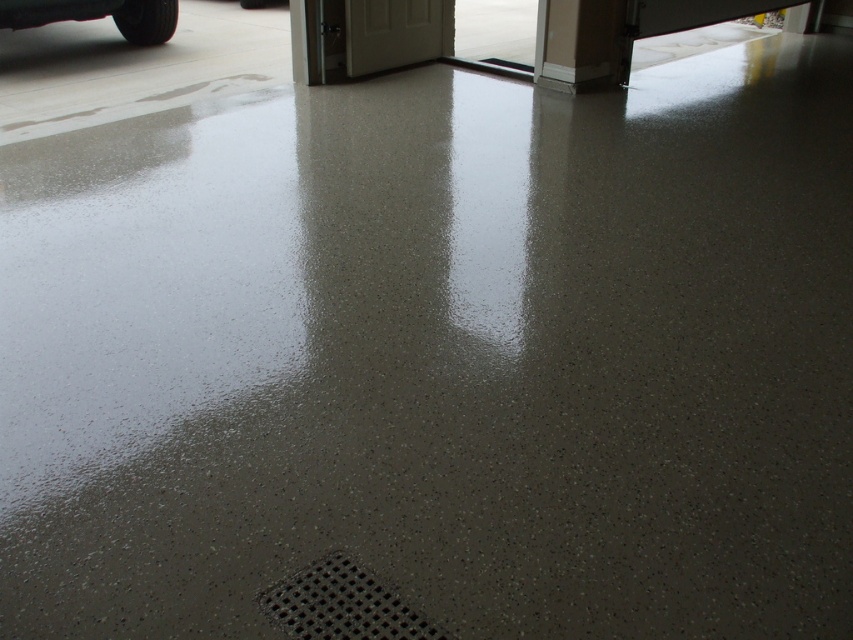
You are standing at the entrance of the garage and want to locate the black textured drain at lower center. According to the coordinates provided, where exactly is the black textured drain located?

The black textured drain at lower center is located at coordinates point (x=341, y=604).